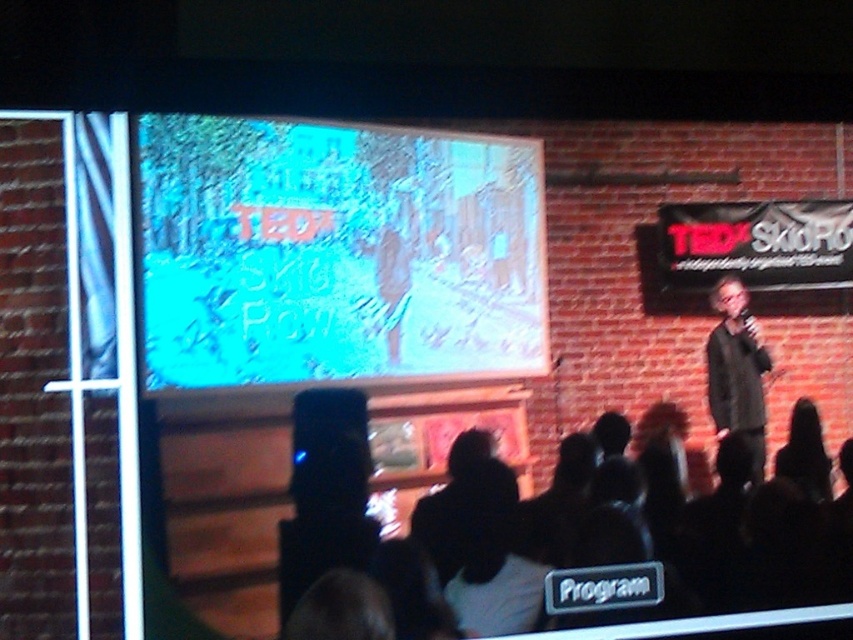
Can you confirm if blue glossy screen at upper center is positioned to the left of black fabric at lower center?

Correct, you'll find blue glossy screen at upper center to the left of black fabric at lower center.

Between point (259, 333) and point (320, 454), which one is positioned in front?

Point (259, 333) is in front.

Which is behind, point (165, 173) or point (434, 506)?

Point (434, 506)

This screenshot has width=853, height=640. I want to click on blue glossy screen at upper center, so click(x=335, y=252).

How distant is blue glossy screen at upper center from dark gray sweater at right?

A distance of 1.17 meters exists between blue glossy screen at upper center and dark gray sweater at right.

Between blue glossy screen at upper center and dark gray sweater at right, which one has more height?

blue glossy screen at upper center is taller.

This screenshot has height=640, width=853. Identify the location of blue glossy screen at upper center. (335, 252).

Describe the element at coordinates (572, 566) in the screenshot. I see `black fabric at lower center` at that location.

Is black fabric at lower center to the right of dark gray sweater at right from the viewer's perspective?

No, black fabric at lower center is not to the right of dark gray sweater at right.

Between point (820, 552) and point (738, 372), which one is positioned behind?

Point (738, 372)

The width and height of the screenshot is (853, 640). What are the coordinates of `black fabric at lower center` in the screenshot? It's located at (572, 566).